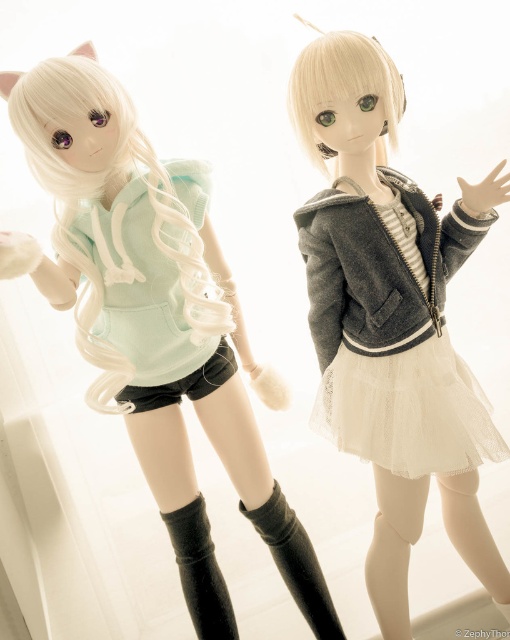
Is black suede boot at lower center bigger than black knitted boot at lower center?

Yes.

Is point (306, 548) farther from camera compared to point (224, 604)?

Yes, point (306, 548) is farther from viewer.

The width and height of the screenshot is (510, 640). In order to click on black suede boot at lower center in this screenshot , I will do [295, 563].

Can you confirm if white lace dress at center is smaller than black matte sock at lower center?

Incorrect, white lace dress at center is not smaller in size than black matte sock at lower center.

Is the position of white lace dress at center more distant than that of black matte sock at lower center?

No, white lace dress at center is closer to the viewer.

Who is more forward, (355, 349) or (505, 604)?

Point (355, 349)

Locate an element on the screen. Image resolution: width=510 pixels, height=640 pixels. white lace dress at center is located at coordinates (392, 333).

Based on the photo, can you confirm if black knitted boot at lower center is positioned to the left of black matte sock at lower center?

Yes, black knitted boot at lower center is to the left of black matte sock at lower center.

Who is higher up, black knitted boot at lower center or black matte sock at lower center?

black knitted boot at lower center is above.

Between point (174, 547) and point (508, 618), which one is positioned behind?

The point (508, 618) is more distant.

The width and height of the screenshot is (510, 640). Identify the location of black knitted boot at lower center. (200, 572).